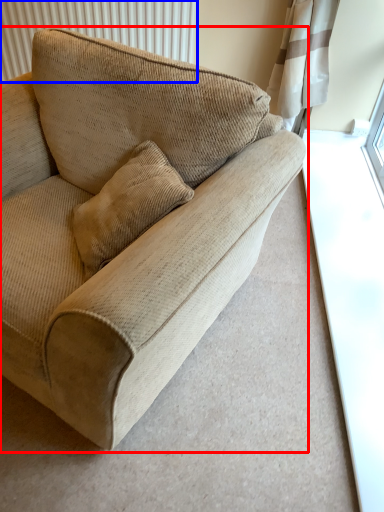
Question: Which point is closer to the camera, studio couch (highlighted by a red box) or radiator (highlighted by a blue box)?

Choices:
 (A) studio couch
 (B) radiator

Answer: (A)